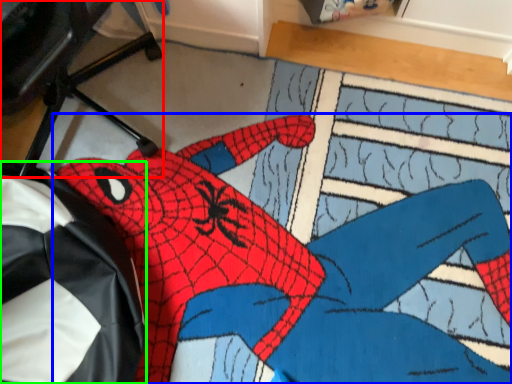
Question: Which is farther away from computer chair (highlighted by a red box)? person (highlighted by a blue box) or bean bag chair (highlighted by a green box)?

Choices:
 (A) person
 (B) bean bag chair

Answer: (A)